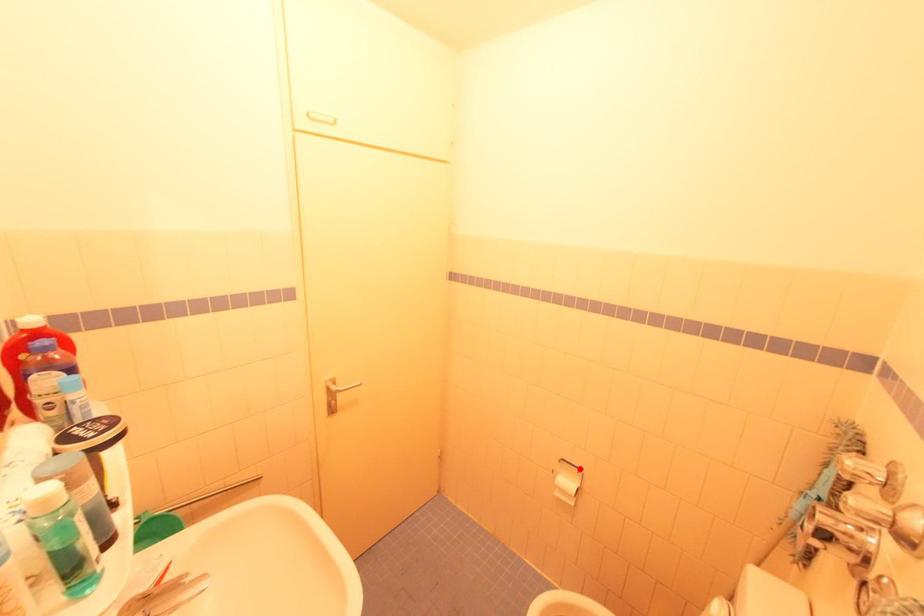
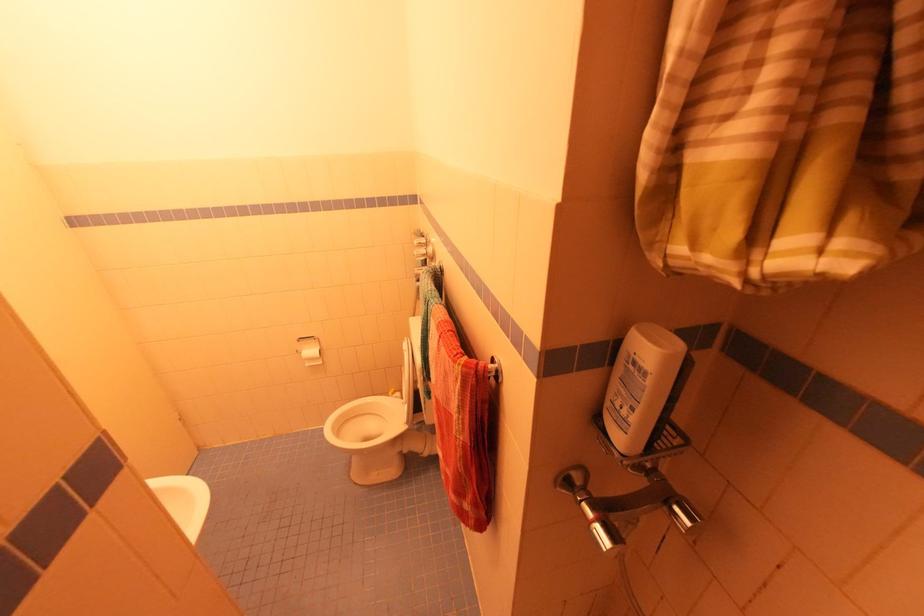
The point at the highlighted location is marked in the first image. Where is the corresponding point in the second image?

(314, 338)